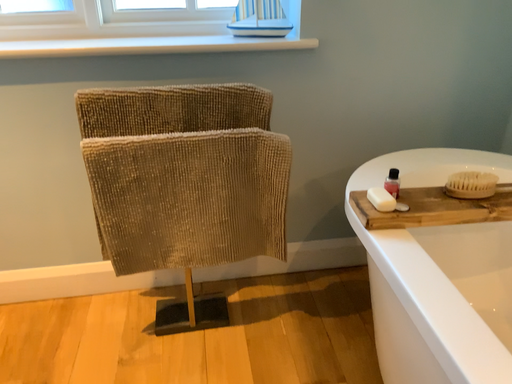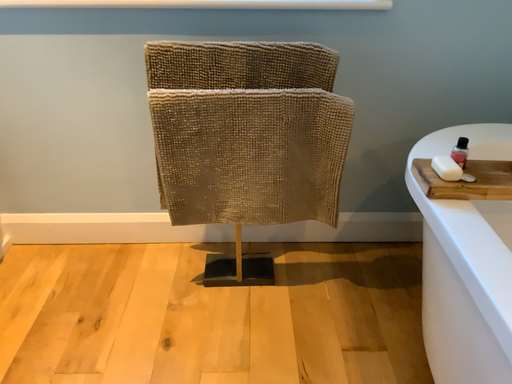
Question: How did the camera likely rotate when shooting the video?

Choices:
 (A) rotated left
 (B) rotated right

Answer: (A)